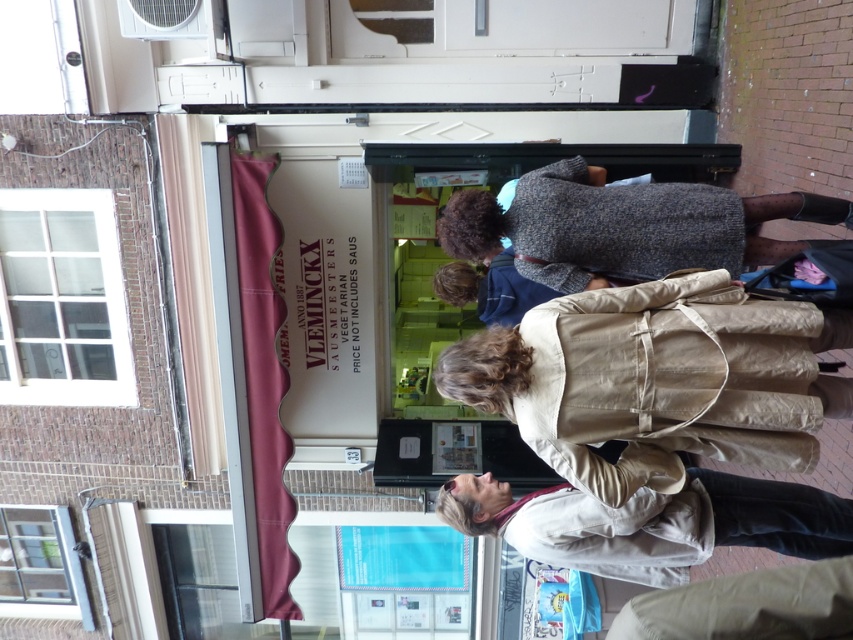
Between knitted sweater at center and light beige jacket at lower center, which one has less height?

With less height is light beige jacket at lower center.

Is knitted sweater at center wider than light beige jacket at lower center?

Correct, the width of knitted sweater at center exceeds that of light beige jacket at lower center.

This screenshot has height=640, width=853. What do you see at coordinates (624, 227) in the screenshot?
I see `knitted sweater at center` at bounding box center [624, 227].

You are a GUI agent. You are given a task and a screenshot of the screen. Output one action in this format:
    pyautogui.click(x=<x>, y=<y>)
    Task: Click on the knitted sweater at center
    The image size is (853, 640).
    Given the screenshot: What is the action you would take?
    pyautogui.click(x=624, y=227)

Does beige fabric coat at lower center appear over knitted sweater at center?

No, beige fabric coat at lower center is not above knitted sweater at center.

Can you confirm if beige fabric coat at lower center is smaller than knitted sweater at center?

Yes, beige fabric coat at lower center is smaller than knitted sweater at center.

Does point (618, 492) come in front of point (682, 189)?

Yes, point (618, 492) is closer to viewer.

Where is `beige fabric coat at lower center`? The width and height of the screenshot is (853, 640). beige fabric coat at lower center is located at coordinates (662, 380).

Can you confirm if beige fabric coat at lower center is thinner than light beige jacket at lower center?

Indeed, beige fabric coat at lower center has a lesser width compared to light beige jacket at lower center.

From the picture: Does beige fabric coat at lower center appear under light beige jacket at lower center?

Answer: No, beige fabric coat at lower center is not below light beige jacket at lower center.

In order to click on beige fabric coat at lower center in this screenshot , I will do `click(662, 380)`.

Where is `beige fabric coat at lower center`? Image resolution: width=853 pixels, height=640 pixels. beige fabric coat at lower center is located at coordinates (662, 380).